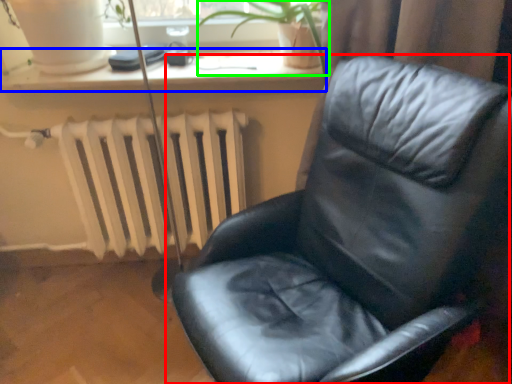
Question: Which object is positioned closest to chair (highlighted by a red box)? Select from window sill (highlighted by a blue box) and plant (highlighted by a green box).

Choices:
 (A) window sill
 (B) plant

Answer: (B)